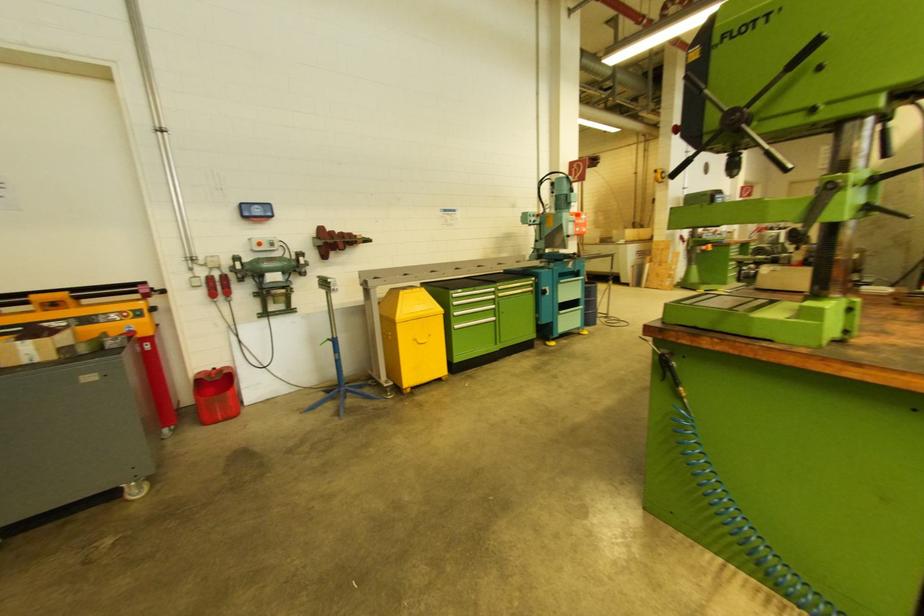
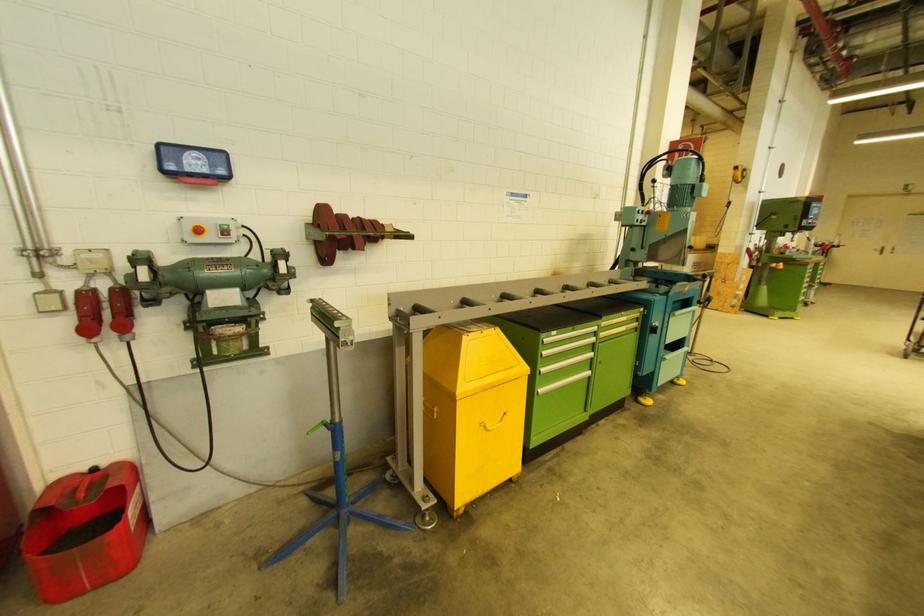
The point at (418,342) is marked in the first image. Where is the corresponding point in the second image?

(488, 432)